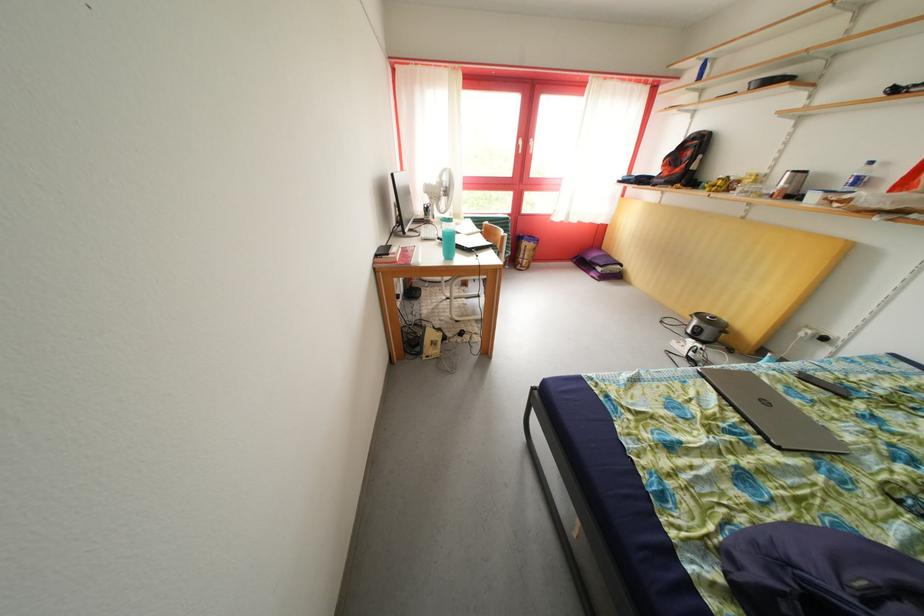
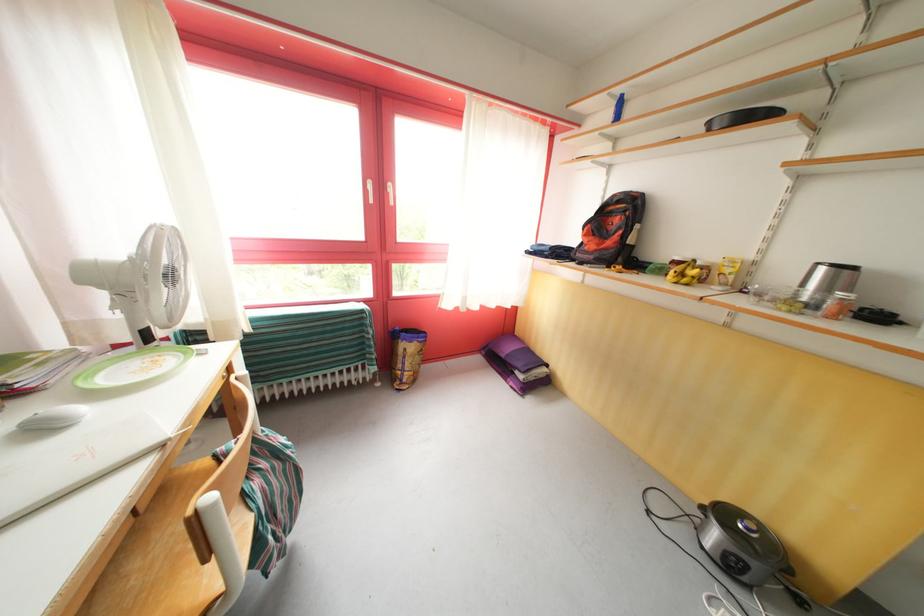
Question: I am providing you with two images of the same scene from different viewpoints. Please identify which objects are invisible in image2.

Choices:
 (A) white window handle
 (B) cooker lid handle
 (C) blue plastic bottle
 (D) none of these

Answer: (D)